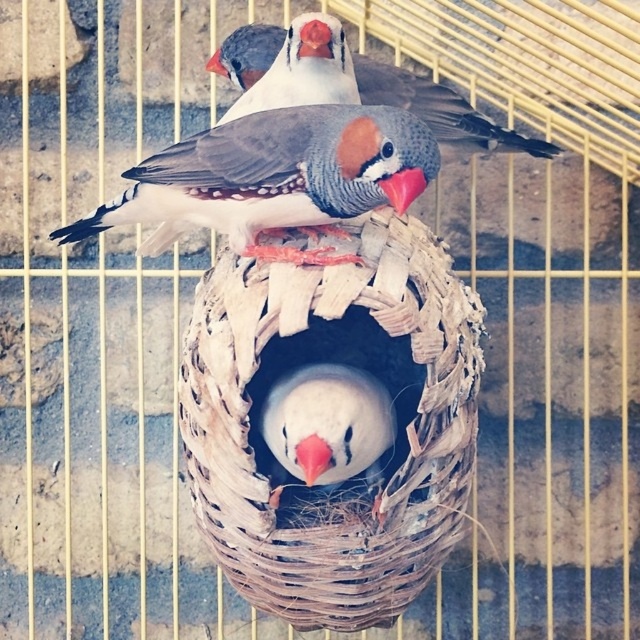
In the scene shown: Which is below, speckled feathered bird at center or speckled feathered bird at upper center?

Positioned lower is speckled feathered bird at center.

Does speckled feathered bird at center lie behind speckled feathered bird at upper center?

No.

Identify the location of speckled feathered bird at center. The width and height of the screenshot is (640, 640). pyautogui.click(x=276, y=177).

Is speckled feathered bird at center wider than white matte bird at center?

Indeed, speckled feathered bird at center has a greater width compared to white matte bird at center.

Does speckled feathered bird at center have a smaller size compared to white matte bird at center?

No.

Image resolution: width=640 pixels, height=640 pixels. Describe the element at coordinates (276, 177) in the screenshot. I see `speckled feathered bird at center` at that location.

The height and width of the screenshot is (640, 640). I want to click on speckled feathered bird at center, so (x=276, y=177).

Is woven straw nest at center bigger than speckled feathered bird at center?

Correct, woven straw nest at center is larger in size than speckled feathered bird at center.

Is woven straw nest at center wider than speckled feathered bird at center?

Incorrect, woven straw nest at center's width does not surpass speckled feathered bird at center's.

Who is more forward, (390, 458) or (307, 211)?

Positioned in front is point (390, 458).

Where is `woven straw nest at center`? The width and height of the screenshot is (640, 640). woven straw nest at center is located at coordinates (358, 378).